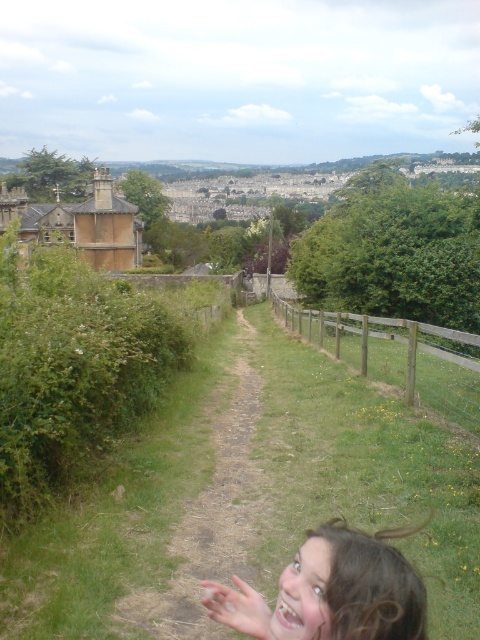
Question: Considering the real-world distances, which object is closest to the curly brown hair at lower center?

Choices:
 (A) green grassy path at center
 (B) translucent skin hand at lower right
 (C) wooden fence at right

Answer: (B)

Question: Does green grassy path at center have a lesser width compared to wooden fence at right?

Choices:
 (A) no
 (B) yes

Answer: (B)

Question: Does wooden fence at right come in front of translucent skin hand at lower right?

Choices:
 (A) yes
 (B) no

Answer: (B)

Question: Can you confirm if wooden fence at right is thinner than translucent skin hand at lower right?

Choices:
 (A) yes
 (B) no

Answer: (B)

Question: Among these objects, which one is nearest to the camera?

Choices:
 (A) translucent skin hand at lower right
 (B) curly brown hair at lower center

Answer: (B)

Question: Which of the following is the closest to the observer?

Choices:
 (A) green grassy path at center
 (B) translucent skin hand at lower right
 (C) wooden fence at right
 (D) curly brown hair at lower center

Answer: (D)